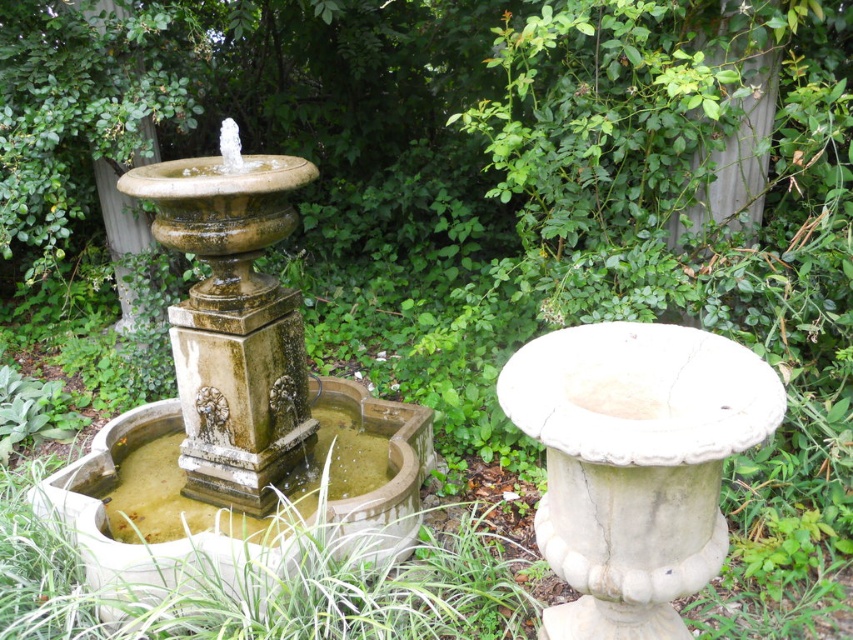
Question: Can you confirm if white marble urn at center is bigger than greenish stone fountain at center?

Choices:
 (A) yes
 (B) no

Answer: (B)

Question: Which point appears farthest from the camera in this image?

Choices:
 (A) (171, 515)
 (B) (735, 416)

Answer: (A)

Question: From the image, what is the correct spatial relationship of speckled stone fountain at center in relation to greenish stone fountain at center?

Choices:
 (A) right
 (B) left

Answer: (B)

Question: Estimate the real-world distances between objects in this image. Which object is closer to the white marble urn at center?

Choices:
 (A) greenish stone fountain at center
 (B) speckled stone fountain at center

Answer: (A)

Question: Is speckled stone fountain at center further to camera compared to greenish stone fountain at center?

Choices:
 (A) no
 (B) yes

Answer: (B)

Question: Which point appears closest to the camera in this image?

Choices:
 (A) (550, 401)
 (B) (119, 524)
 (C) (171, 445)

Answer: (A)